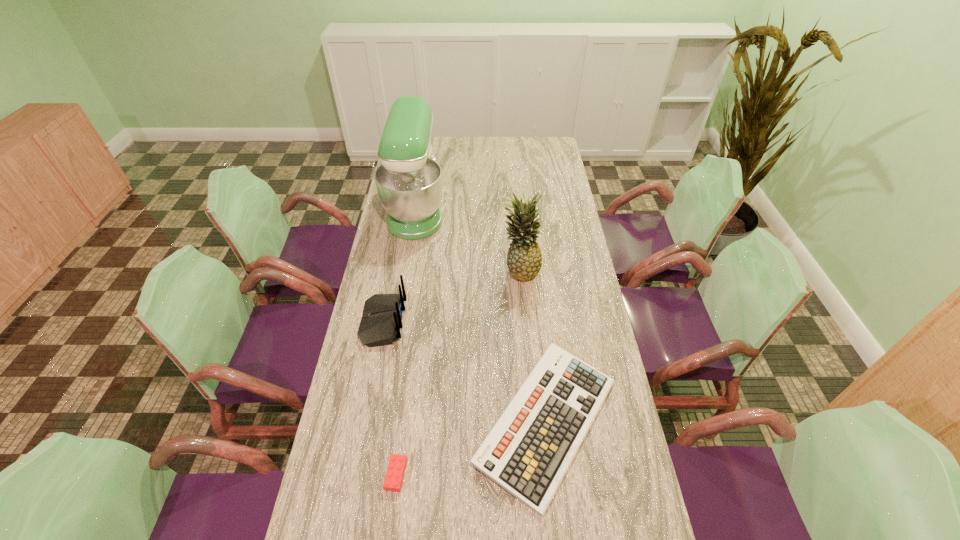
Image resolution: width=960 pixels, height=540 pixels. Find the location of `the tallest object`. the tallest object is located at coordinates pyautogui.click(x=409, y=180).

At what (x,y) coordinates should I click in order to perform the action: click on mixer. Please return your answer as a coordinate pair (x, y). Looking at the image, I should click on (409, 180).

Locate an element on the screen. This screenshot has height=540, width=960. the second tallest object is located at coordinates (524, 259).

This screenshot has width=960, height=540. What are the coordinates of `pineapple` in the screenshot? It's located at (524, 259).

Image resolution: width=960 pixels, height=540 pixels. I want to click on router, so click(x=382, y=313).

The height and width of the screenshot is (540, 960). I want to click on the third shortest object, so click(x=382, y=313).

You are a GUI agent. You are given a task and a screenshot of the screen. Output one action in this format:
    pyautogui.click(x=<x>, y=<y>)
    Task: Click on the second shortest object
    The image size is (960, 540).
    Given the screenshot: What is the action you would take?
    pyautogui.click(x=530, y=448)

Find the location of a particular element. This screenshot has width=960, height=540. the shortest object is located at coordinates (394, 477).

Where is `free space located on the controls of the mixer`? free space located on the controls of the mixer is located at coordinates coord(516,210).

You are a GUI agent. You are given a task and a screenshot of the screen. Output one action in this format:
    pyautogui.click(x=<x>, y=<y>)
    Task: Click on the free space located on the left of the second tallest object
    
    Given the screenshot: What is the action you would take?
    pos(417,270)